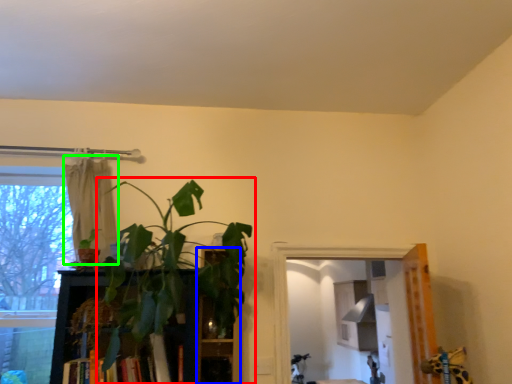
Question: Which object is the closest to the houseplant (highlighted by a red box)? Choose among these: shelf (highlighted by a blue box) or curtain (highlighted by a green box).

Choices:
 (A) shelf
 (B) curtain

Answer: (A)